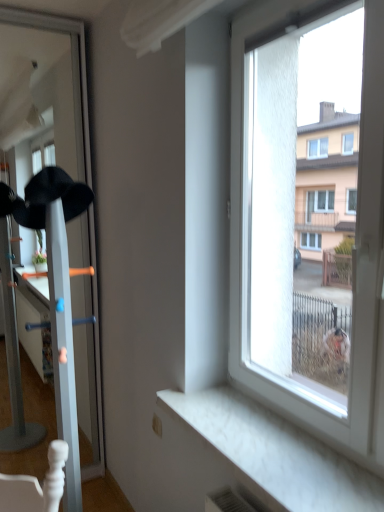
I want to click on free point above white marble window sill at lower right (from a real-world perspective), so pos(278,450).